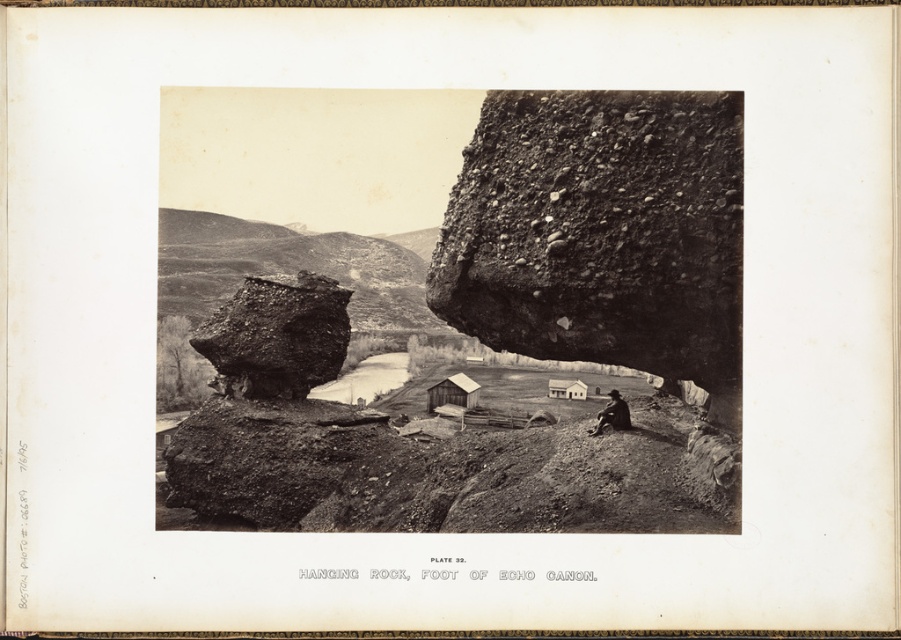
From the picture: You are planning to take a photo of the rustic wood cabin at center and the dark brown leather jacket at lower right. Which object should you focus on first if you want to capture both in the same frame without moving the camera?

The rustic wood cabin at center is taller than the dark brown leather jacket at lower right, so you should focus on the rustic wood cabin at center first to ensure it fits within the frame.